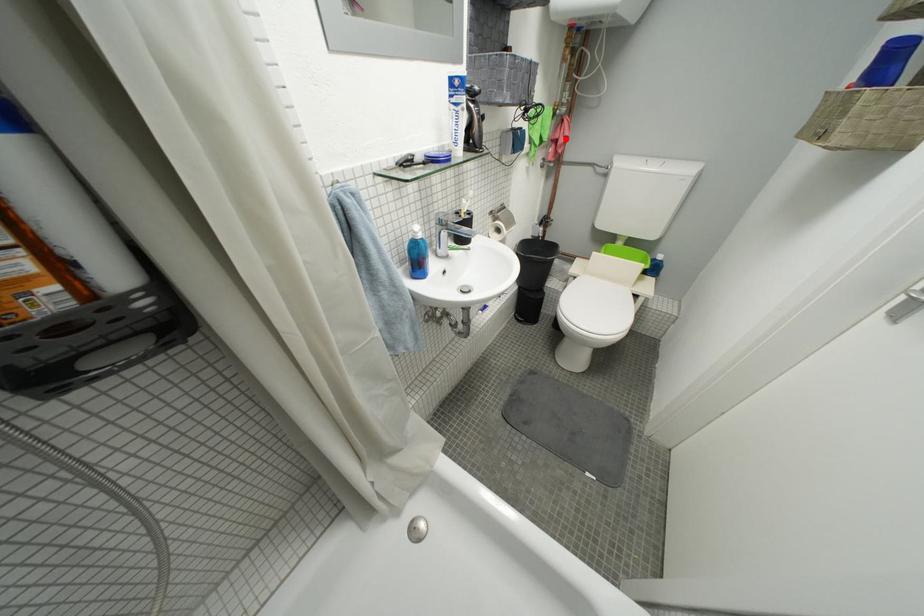
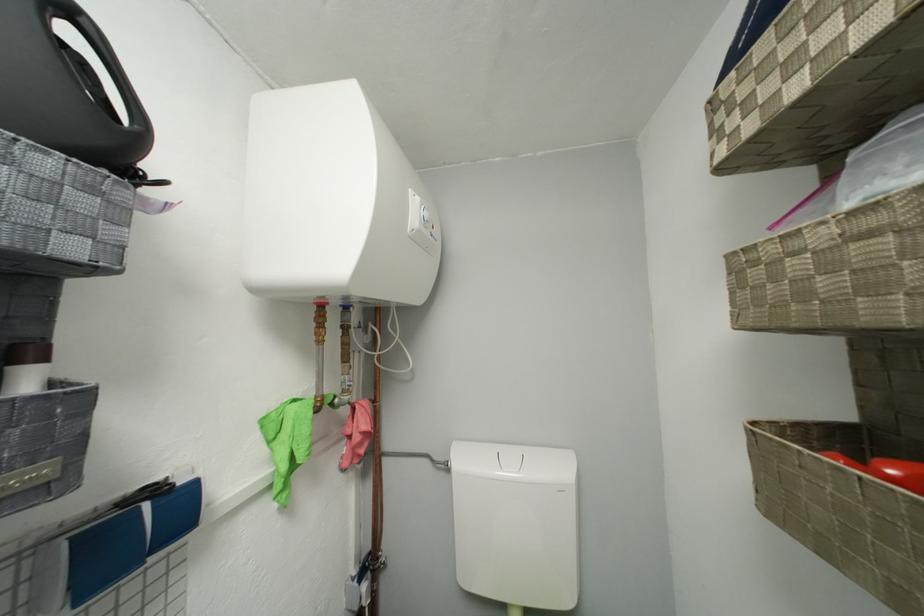
Where in the second image is the point corresponding to the highlighted location from the first image?

(358, 435)